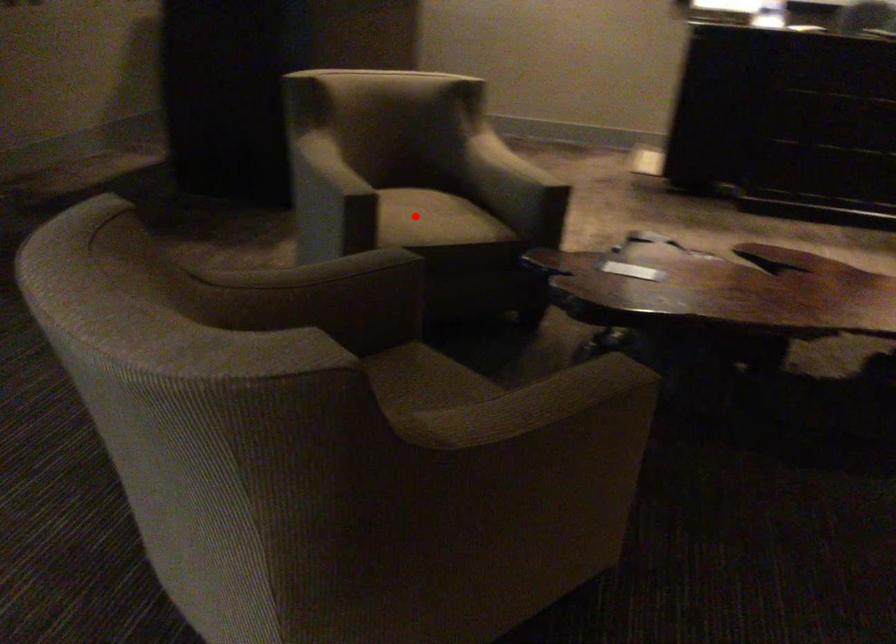
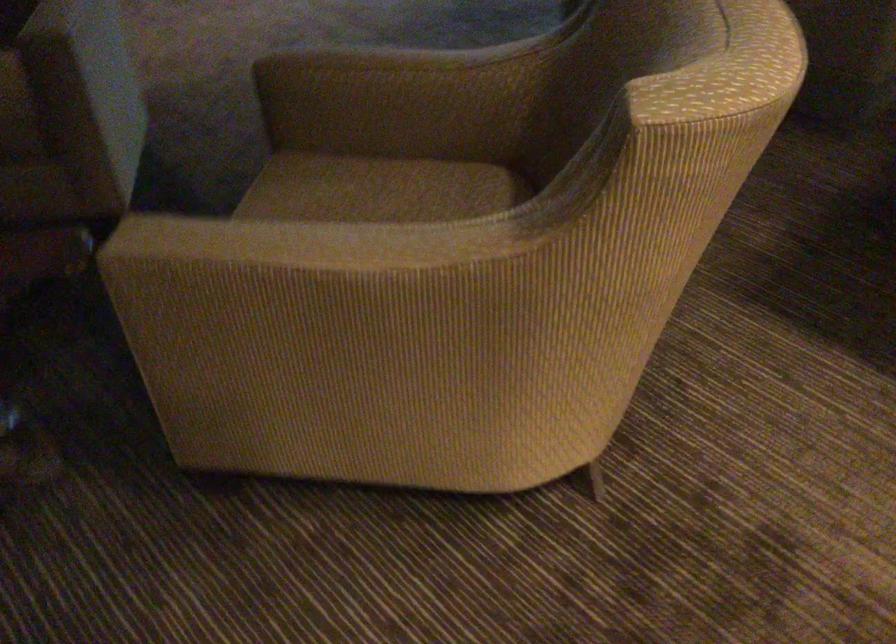
Question: I am providing you with two images of the same scene from different viewpoints. Given a red point in image1, look at the same physical point in image2. Is it:

Choices:
 (A) Closer to the viewpoint
 (B) Farther from the viewpoint

Answer: (A)